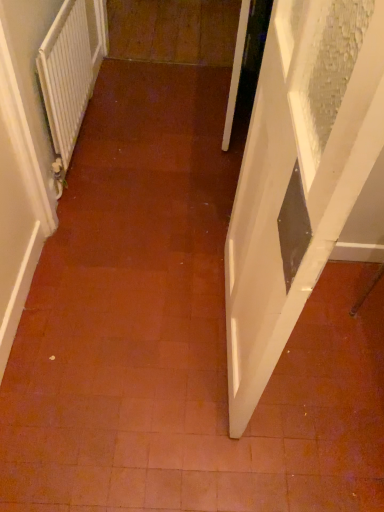
Where is `white glossy door at right`? white glossy door at right is located at coordinates (298, 176).

The width and height of the screenshot is (384, 512). Describe the element at coordinates (298, 176) in the screenshot. I see `white glossy door at right` at that location.

The image size is (384, 512). Describe the element at coordinates (69, 72) in the screenshot. I see `white textured radiator at left` at that location.

The image size is (384, 512). I want to click on white textured radiator at left, so click(69, 72).

Find the location of a particular element. This screenshot has height=512, width=384. white glossy door at right is located at coordinates [x=298, y=176].

Considering the relative positions of white textured radiator at left and white glossy door at right in the image provided, is white textured radiator at left to the left or to the right of white glossy door at right?

From the image, it's evident that white textured radiator at left is to the left of white glossy door at right.

Which object is more forward, white textured radiator at left or white glossy door at right?

Positioned in front is white glossy door at right.

Which is more distant, (77, 14) or (271, 154)?

The point (77, 14) is farther.

From the image's perspective, which is above, white textured radiator at left or white glossy door at right?

white textured radiator at left appears higher in the image.

From a real-world perspective, between white textured radiator at left and white glossy door at right, who is vertically higher?

white glossy door at right.

Considering the relative sizes of white textured radiator at left and white glossy door at right in the image provided, is white textured radiator at left thinner than white glossy door at right?

Yes, white textured radiator at left is thinner than white glossy door at right.

Considering the sizes of objects white textured radiator at left and white glossy door at right in the image provided, who is taller, white textured radiator at left or white glossy door at right?

white glossy door at right is taller.

Is white textured radiator at left bigger than white glossy door at right?

Actually, white textured radiator at left might be smaller than white glossy door at right.

Is white textured radiator at left spatially inside white glossy door at right, or outside of it?

white textured radiator at left cannot be found inside white glossy door at right.

Based on the photo, is there a large distance between white textured radiator at left and white glossy door at right?

Absolutely, white textured radiator at left is distant from white glossy door at right.

Could you tell me if white textured radiator at left is turned towards white glossy door at right?

No, white textured radiator at left is not oriented towards white glossy door at right.

Find the location of a particular element. door that appears below the white textured radiator at left (from the image's perspective) is located at coordinates (298, 176).

Can you confirm if white glossy door at right is positioned to the left of white textured radiator at left?

No, white glossy door at right is not to the left of white textured radiator at left.

Which object is further away from the camera, white glossy door at right or white textured radiator at left?

Positioned behind is white textured radiator at left.

Which is less distant, (246, 176) or (73, 101)?

The point (246, 176) is closer.

From the image's perspective, who appears lower, white glossy door at right or white textured radiator at left?

From the image's view, white glossy door at right is below.

From a real-world perspective, between white glossy door at right and white textured radiator at left, who is vertically higher?

white glossy door at right, from a real-world perspective.

Looking at this image, can you confirm if white glossy door at right is thinner than white textured radiator at left?

No.

Can you confirm if white glossy door at right is taller than white textured radiator at left?

Correct, white glossy door at right is much taller as white textured radiator at left.

Considering the sizes of objects white glossy door at right and white textured radiator at left in the image provided, who is smaller, white glossy door at right or white textured radiator at left?

With smaller size is white textured radiator at left.

Is white glossy door at right not within white textured radiator at left?

Yes, white glossy door at right is outside of white textured radiator at left.

Is white glossy door at right not near white textured radiator at left?

Yes.

Is white glossy door at right oriented away from white textured radiator at left?

No, white glossy door at right's orientation is not away from white textured radiator at left.

Measure the distance from white glossy door at right to white textured radiator at left.

The distance of white glossy door at right from white textured radiator at left is 1.12 meters.

You are a GUI agent. You are given a task and a screenshot of the screen. Output one action in this format:
    pyautogui.click(x=<x>, y=<y>)
    Task: Click on the door below the white textured radiator at left (from the image's perspective)
    The width and height of the screenshot is (384, 512).
    Given the screenshot: What is the action you would take?
    pyautogui.click(x=298, y=176)

The image size is (384, 512). I want to click on door located on the right of white textured radiator at left, so click(298, 176).

Locate an element on the screen. This screenshot has width=384, height=512. radiator directly beneath the white glossy door at right (from a real-world perspective) is located at coordinates (69, 72).